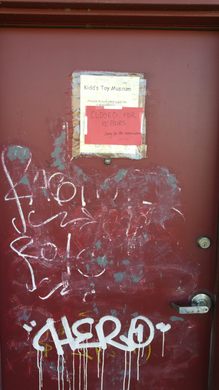
Where is `peep hole maybe`? peep hole maybe is located at coordinates (108, 162).